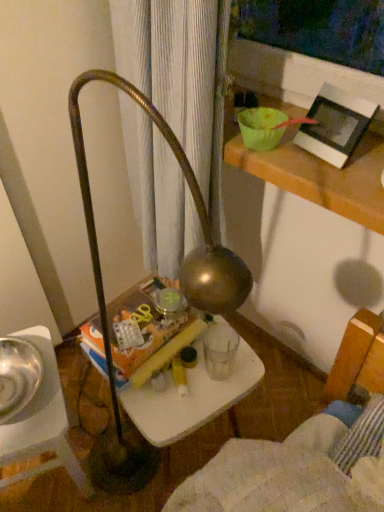
This screenshot has height=512, width=384. What are the coordinates of `free space above white plastic table at center (from a real-world perspective)` in the screenshot? It's located at (194, 373).